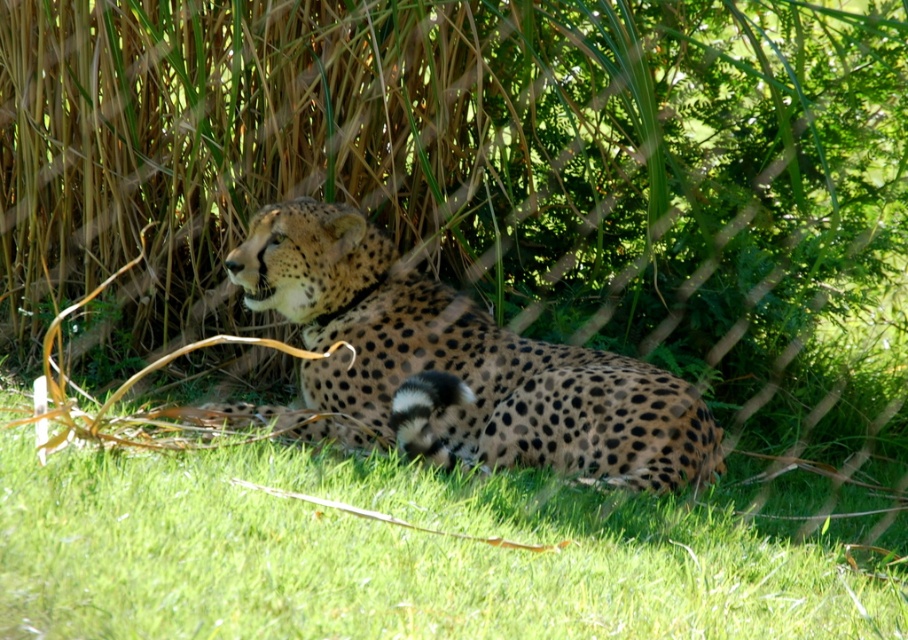
Can you confirm if green grass at lower center is smaller than spotted fur cheetah at center?

No, green grass at lower center is not smaller than spotted fur cheetah at center.

Does point (169, 598) come in front of point (240, 288)?

Yes.

Where is `green grass at lower center`? green grass at lower center is located at coordinates (390, 554).